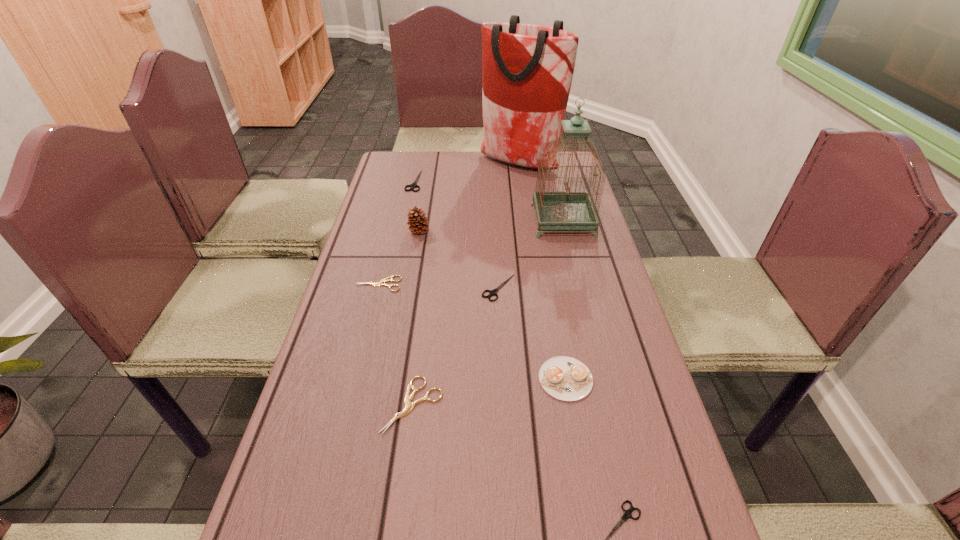
Locate an element on the screen. The width and height of the screenshot is (960, 540). the second shears from right to left is located at coordinates (493, 292).

Locate an element on the screen. This screenshot has width=960, height=540. the bigger beige shears is located at coordinates (409, 406).

The width and height of the screenshot is (960, 540). Identify the location of the right beige shears. (409, 406).

Image resolution: width=960 pixels, height=540 pixels. What are the coordinates of `the left beige shears` in the screenshot? It's located at (380, 283).

You are a GUI agent. You are given a task and a screenshot of the screen. Output one action in this format:
    pyautogui.click(x=<x>, y=<y>)
    Task: Click on the smaller beige shears
    The image size is (960, 540).
    Given the screenshot: What is the action you would take?
    pyautogui.click(x=380, y=283)

What are the coordinates of `free space located 0.120m on the front of the tallest object` in the screenshot? It's located at (524, 198).

Locate an element on the screen. The image size is (960, 540). vacant space situated at the door of the eighth shortest object is located at coordinates (490, 220).

The width and height of the screenshot is (960, 540). I want to click on blank space located 0.390m at the door of the eighth shortest object, so click(411, 220).

Where is `vacant space located at the door of the eighth shortest object`? vacant space located at the door of the eighth shortest object is located at coordinates (474, 220).

Locate an element on the screen. free space located 0.230m on the right of the pinecone is located at coordinates [504, 232].